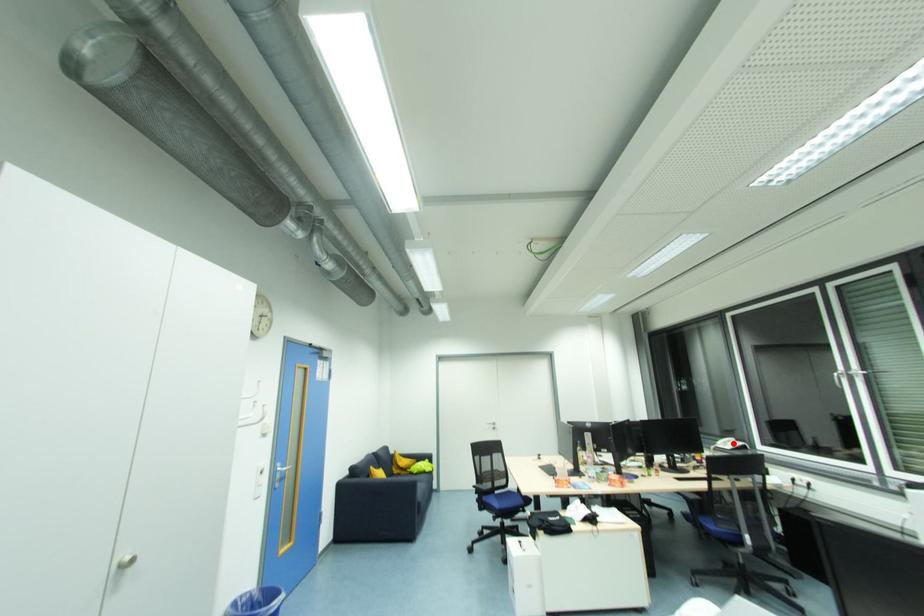
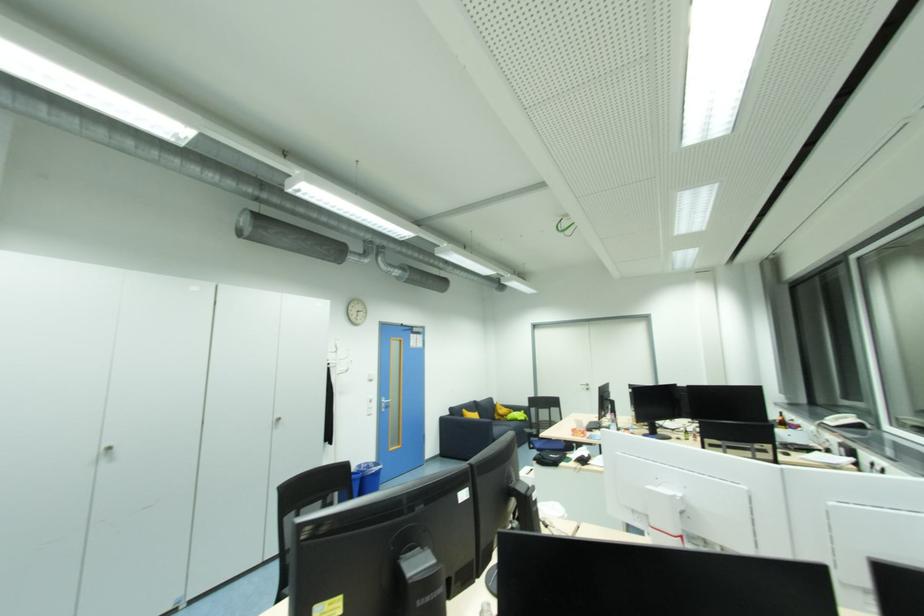
Locate, in the second image, the point that corresponds to the highlighted location in the first image.

(850, 419)